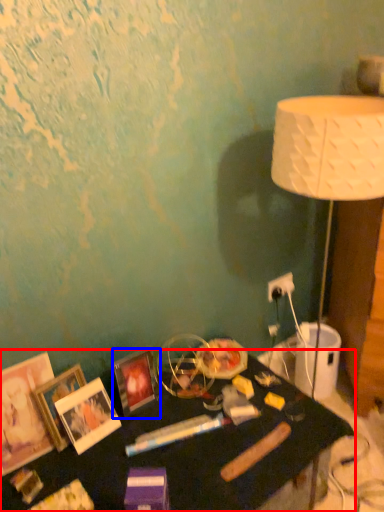
Question: Which object is closer to the camera taking this photo, table (highlighted by a red box) or picture frame (highlighted by a blue box)?

Choices:
 (A) table
 (B) picture frame

Answer: (A)